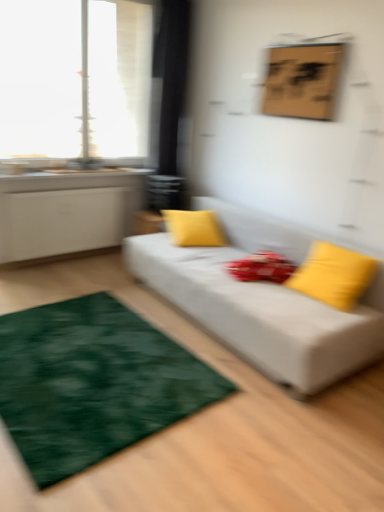
Find the location of `free space below green plush rug at lower left (from a real-world perspective)`. free space below green plush rug at lower left (from a real-world perspective) is located at coordinates (93, 358).